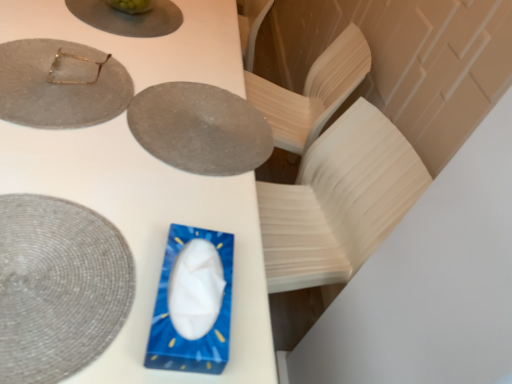
Where is `vacant space that's between matte gray placemat at upper left, which appears as the third plate when ordered from the bottom, and matte gray plate at upper center, the second plate positioned from the bottom`? vacant space that's between matte gray placemat at upper left, which appears as the third plate when ordered from the bottom, and matte gray plate at upper center, the second plate positioned from the bottom is located at coordinates (132, 84).